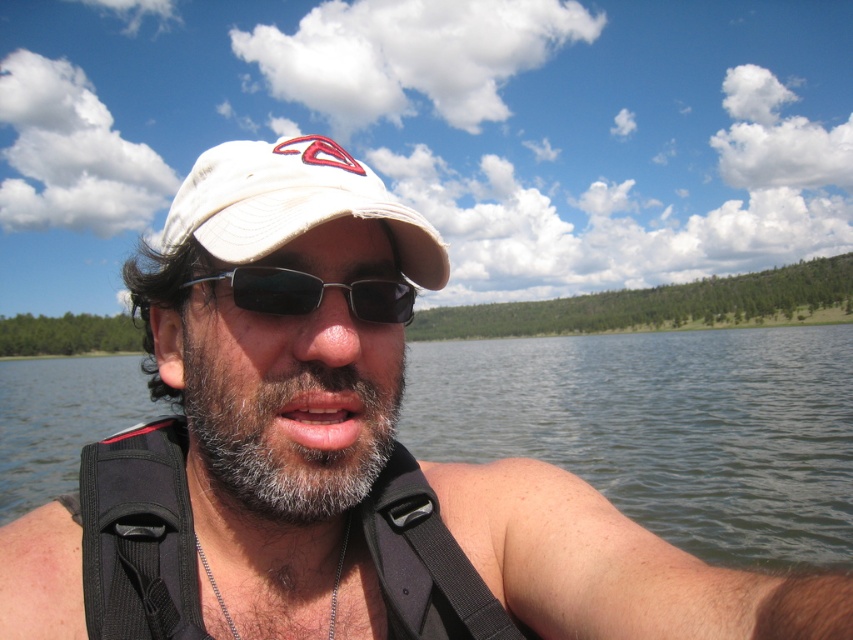
You are a photographer trying to capture a close portrait of the person. You need to focus on the gray matte beard at center and the black fabric strap at lower center. Which of these two features is taller in the image?

The gray matte beard at center is taller than the black fabric strap at lower center according to the description.

You are a photographer taking a portrait of the person in the scene. You notice the gray matte beard at center and the black plastic sunglasses at center. Which object should you focus on first if you want to capture the one that is higher up?

The gray matte beard at center is much taller than the black plastic sunglasses at center, so you should focus on the gray matte beard at center first to capture the higher object.

You are a photographer trying to capture the scene. You notice two points in the image at coordinates point (798, 540) and point (375, 186). Which point is closer to your camera lens?

Point (798, 540) is further to the viewer than point (375, 186), so the point closer to the camera lens is point (375, 186).